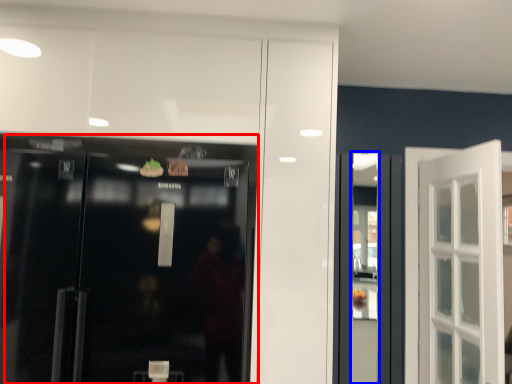
Question: Which of the following is the closest to the observer, door (highlighted by a red box) or shop window (highlighted by a blue box)?

Choices:
 (A) door
 (B) shop window

Answer: (A)